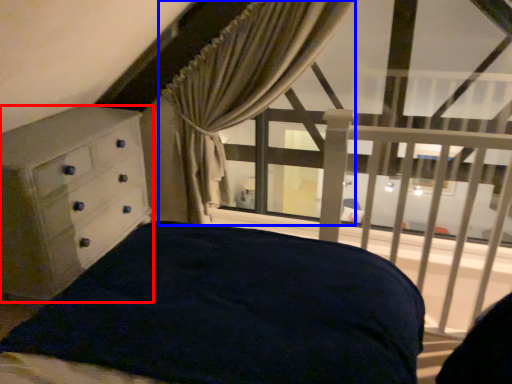
Question: Which object appears closest to the camera in this image, chest of drawers (highlighted by a red box) or curtain (highlighted by a blue box)?

Choices:
 (A) chest of drawers
 (B) curtain

Answer: (A)